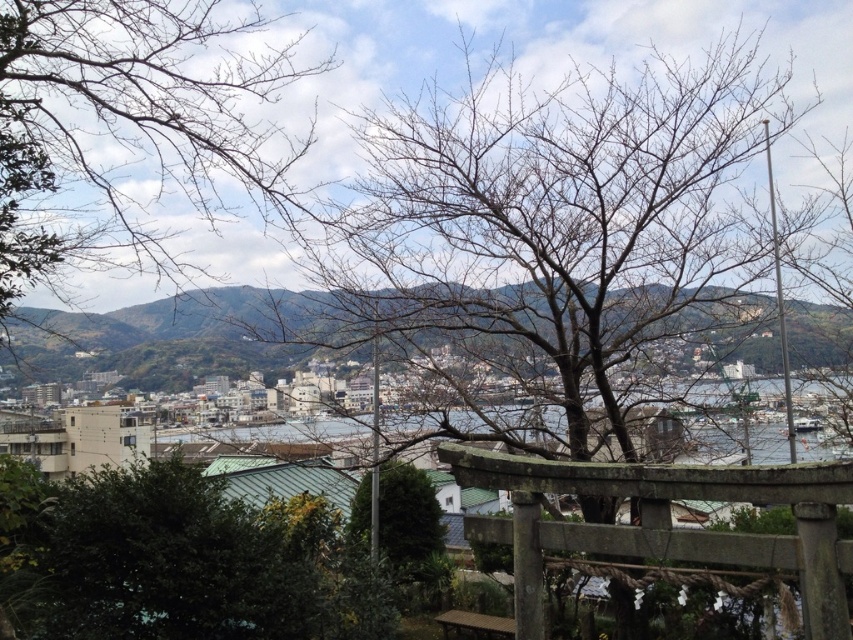
Is bare branches at upper left in front of green leafy tree at center?

Yes, bare branches at upper left is in front of green leafy tree at center.

This screenshot has height=640, width=853. In order to click on bare branches at upper left in this screenshot , I will do `click(125, 131)`.

Identify the location of bare branches at upper left. (125, 131).

Does bare wood tree at center have a lesser height compared to bare branches at upper left?

No, bare wood tree at center is not shorter than bare branches at upper left.

Describe the element at coordinates (582, 294) in the screenshot. I see `bare wood tree at center` at that location.

The width and height of the screenshot is (853, 640). I want to click on bare wood tree at center, so pyautogui.click(x=582, y=294).

Which is more to the right, bare wood tree at center or green leafy tree at center?

From the viewer's perspective, bare wood tree at center appears more on the right side.

Between point (668, 262) and point (381, 545), which one is positioned in front?

Point (668, 262)

Is point (560, 522) positioned after point (428, 484)?

That is False.

The image size is (853, 640). What are the coordinates of `bare wood tree at center` in the screenshot? It's located at 582,294.